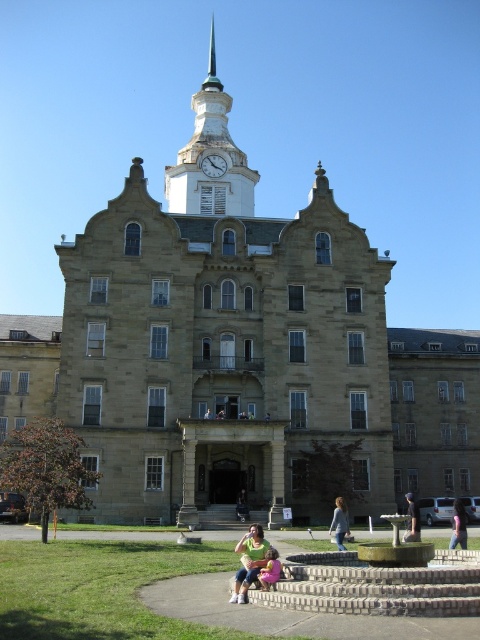
Where is `stone clock tower at center`? stone clock tower at center is located at coordinates (222, 339).

Based on the photo, can you confirm if stone clock tower at center is wider than dark blue jeans at lower right?

Yes.

Is point (155, 406) farther from viewer compared to point (459, 524)?

That is True.

Image resolution: width=480 pixels, height=640 pixels. In order to click on stone clock tower at center in this screenshot , I will do `click(222, 339)`.

Does matte green shirt at center have a smaller size compared to white glossy clock at upper center?

No.

Is matte green shirt at center below white glossy clock at upper center?

Correct, matte green shirt at center is located below white glossy clock at upper center.

The width and height of the screenshot is (480, 640). Identify the location of matte green shirt at center. (249, 561).

Measure the distance between point (x=268, y=580) and camera.

They are 36.40 meters apart.

Does pink fabric at lower center appear on the right side of white glossy clock at upper center?

Indeed, pink fabric at lower center is positioned on the right side of white glossy clock at upper center.

Find the location of a particular element. Image resolution: width=480 pixels, height=640 pixels. pink fabric at lower center is located at coordinates (269, 570).

Where is `pink fabric at lower center`? This screenshot has width=480, height=640. pink fabric at lower center is located at coordinates (269, 570).